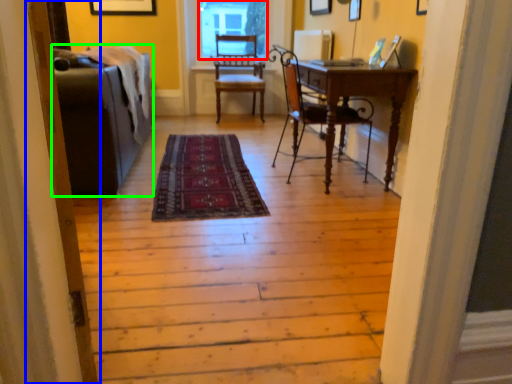
Question: Which object is positioned closest to window screen (highlighted by a red box)? Select from screen door (highlighted by a blue box) and couch (highlighted by a green box).

Choices:
 (A) screen door
 (B) couch

Answer: (B)